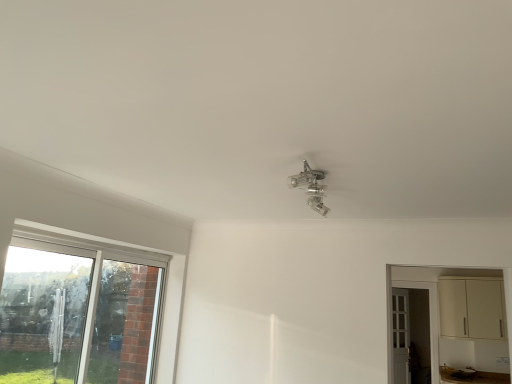
Question: Which is correct: cream matte cabinet at right is inside white wooden door at right, or outside of it?

Choices:
 (A) outside
 (B) inside

Answer: (A)

Question: From their relative heights in the image, would you say cream matte cabinet at right is taller or shorter than white wooden door at right?

Choices:
 (A) short
 (B) tall

Answer: (A)

Question: Estimate the real-world distances between objects in this image. Which object is closer to the clear glass screen door at center?

Choices:
 (A) cream matte cabinet at right
 (B) clear plastic umbrella at left
 (C) white wooden door at right
 (D) metallic glass light fixture at center
 (E) clear glass window at lower left

Answer: (C)

Question: Estimate the real-world distances between objects in this image. Which object is closer to the metallic glass light fixture at center?

Choices:
 (A) clear glass window at lower left
 (B) white wooden door at right
 (C) clear plastic umbrella at left
 (D) cream matte cabinet at right
 (E) clear glass screen door at center

Answer: (A)